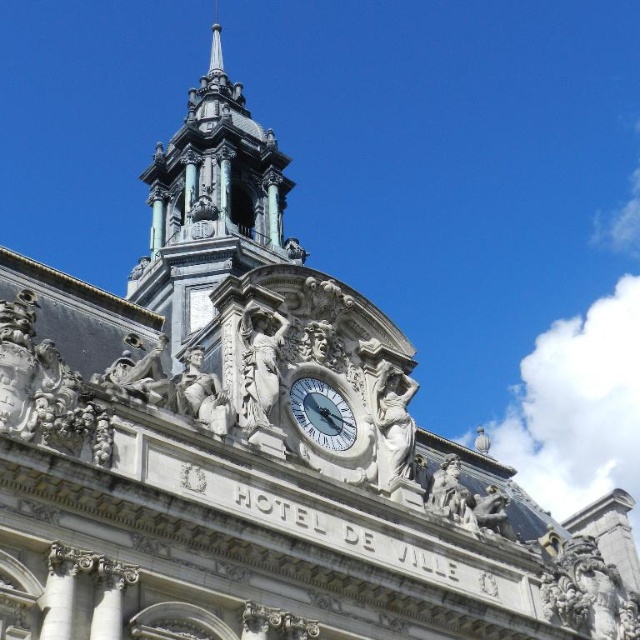
Question: Is polished bronze spire at upper center bigger than white marble clock at center?

Choices:
 (A) no
 (B) yes

Answer: (B)

Question: Does polished bronze spire at upper center appear on the left side of white marble clock at center?

Choices:
 (A) yes
 (B) no

Answer: (A)

Question: Is polished bronze spire at upper center to the right of white marble clock at center from the viewer's perspective?

Choices:
 (A) no
 (B) yes

Answer: (A)

Question: Which point appears closest to the camera in this image?

Choices:
 (A) (346, 412)
 (B) (196, 120)

Answer: (A)

Question: Among these objects, which one is farthest from the camera?

Choices:
 (A) polished bronze spire at upper center
 (B) white marble clock at center

Answer: (A)